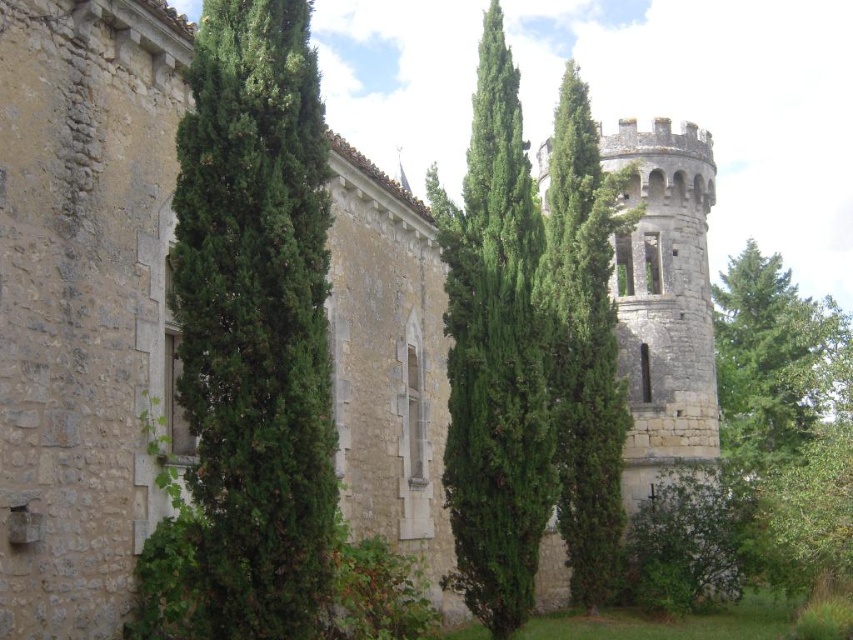
Is green textured tree at center further to the viewer compared to green textured stone tower at center?

No, it is in front of green textured stone tower at center.

Is green textured tree at center below green textured stone tower at center?

Indeed, green textured tree at center is positioned under green textured stone tower at center.

This screenshot has width=853, height=640. What do you see at coordinates (494, 355) in the screenshot?
I see `green textured tree at center` at bounding box center [494, 355].

This screenshot has height=640, width=853. In order to click on green textured tree at center in this screenshot , I will do `click(494, 355)`.

Can you confirm if green leafy tree at right is wider than green textured stone tower at center?

Indeed, green leafy tree at right has a greater width compared to green textured stone tower at center.

Where is `green leafy tree at right`? The image size is (853, 640). green leafy tree at right is located at coordinates (786, 417).

Can you confirm if green textured tree at left is taller than green leafy tree at right?

No, green textured tree at left is not taller than green leafy tree at right.

Can you confirm if green textured tree at left is positioned above green leafy tree at right?

Correct, green textured tree at left is located above green leafy tree at right.

Is point (248, 129) in front of point (804, 388)?

Yes, it is in front of point (804, 388).

Find the location of a particular element. The image size is (853, 640). green textured tree at left is located at coordinates (254, 321).